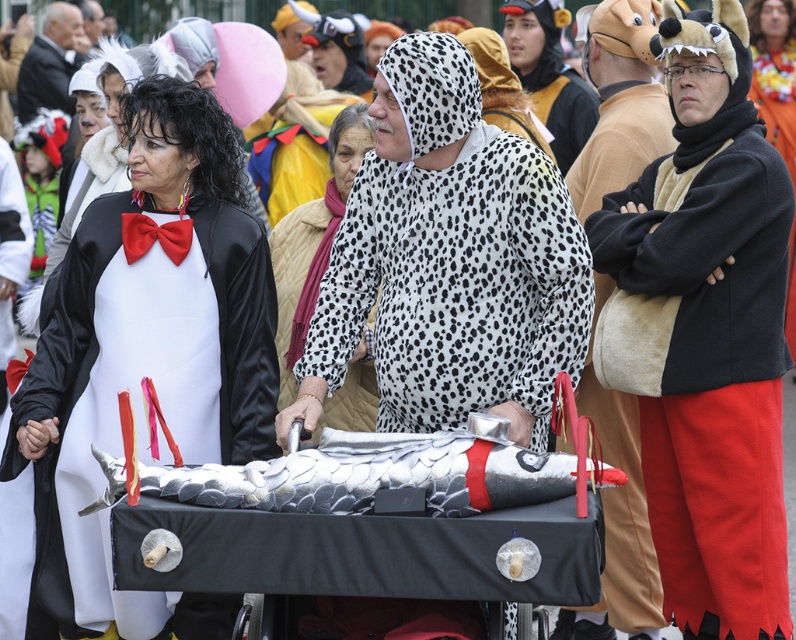
Question: Is white matte penguin costume at left to the left of metallic silver fish at center from the viewer's perspective?

Choices:
 (A) yes
 (B) no

Answer: (A)

Question: Is white matte penguin costume at left to the right of white quilted vest at center from the viewer's perspective?

Choices:
 (A) no
 (B) yes

Answer: (A)

Question: Which point appears closest to the camera in this image?

Choices:
 (A) (660, 106)
 (B) (151, 604)

Answer: (B)

Question: Which object appears closest to the camera in this image?

Choices:
 (A) velvet brown robe at right
 (B) white quilted vest at center

Answer: (A)

Question: Does metallic silver fish at center lie in front of white quilted vest at center?

Choices:
 (A) no
 (B) yes

Answer: (B)

Question: Which of the following is the farthest from the observer?

Choices:
 (A) (630, 166)
 (B) (207, 595)
 (C) (299, 324)
 (D) (498, 161)

Answer: (A)